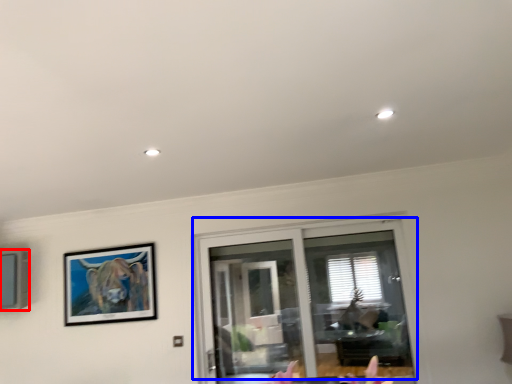
Question: Which point is further to the camera, picture frame (highlighted by a red box) or window (highlighted by a blue box)?

Choices:
 (A) picture frame
 (B) window

Answer: (A)